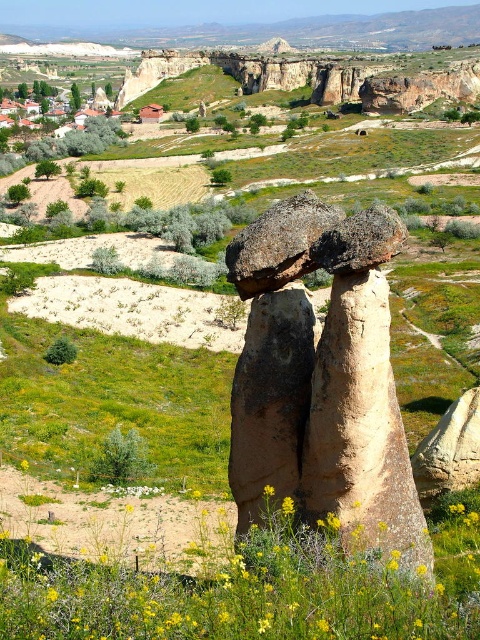
You are a hiker standing in the fairy chimneys area of Cappadocia. You notice a brown textured rock formation at center and a yellow soft textured wildflower at center. Which object is closer to you?

The yellow soft textured wildflower at center is closer to you because the brown textured rock formation at center is further away.

You are a geologist studying the fairy chimneys of Cappadocia. You need to locate the brown textured rock formation at center. What are its coordinates?

The brown textured rock formation at center is located at coordinates point (x=323, y=378).